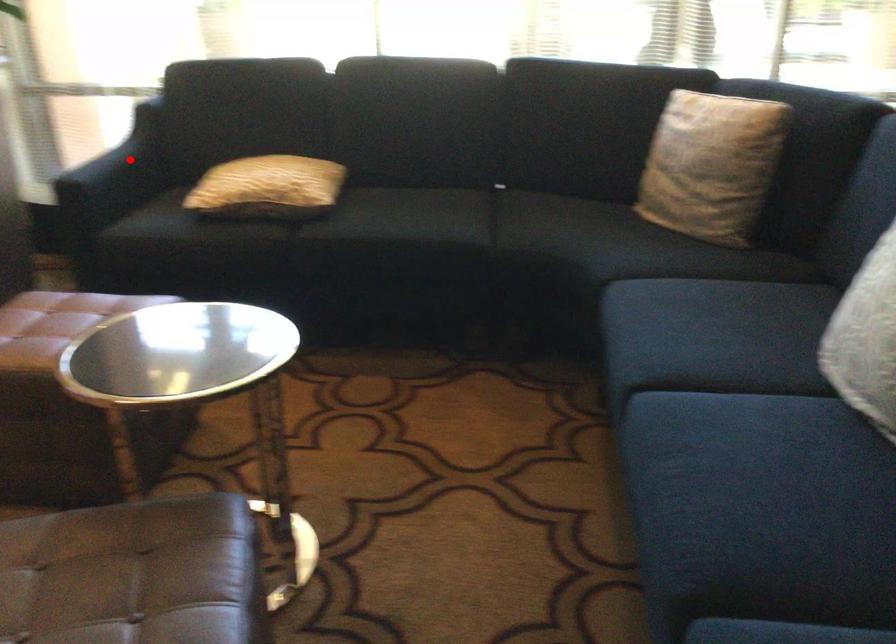
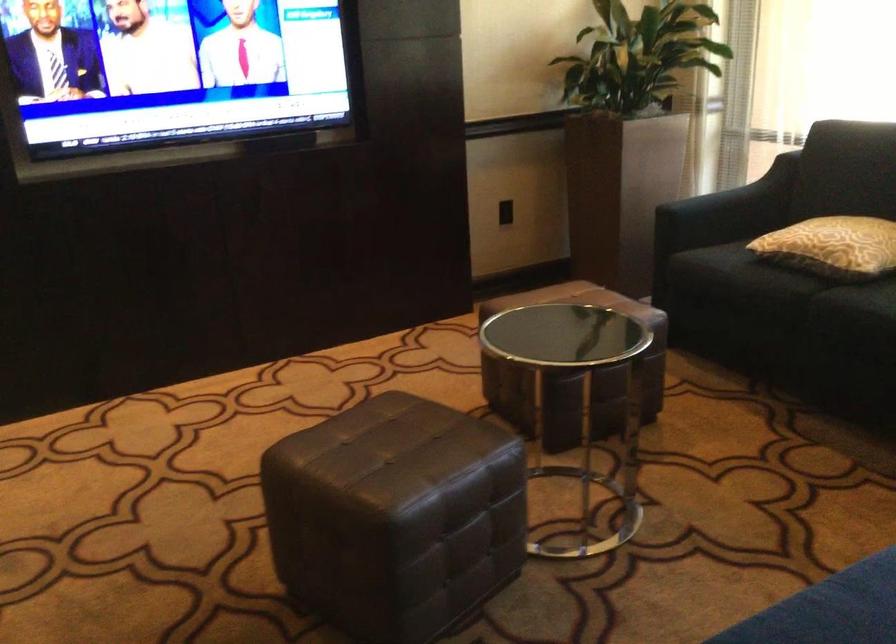
In the second image, find the point that corresponds to the highlighted location in the first image.

(742, 196)